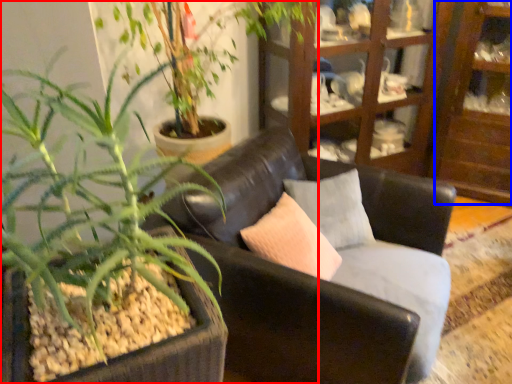
Question: Which of the following is the closest to the observer, houseplant (highlighted by a red box) or shelf (highlighted by a blue box)?

Choices:
 (A) houseplant
 (B) shelf

Answer: (A)